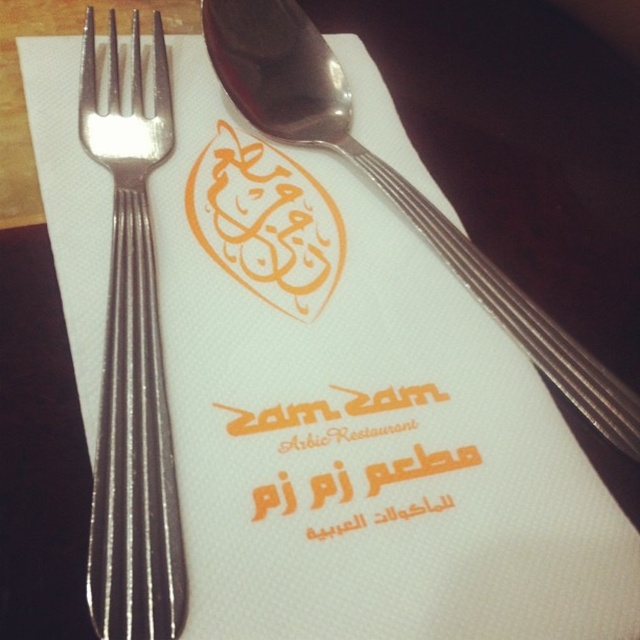
Between point (480, 468) and point (531, 305), which one is positioned in front?

Point (480, 468) is more forward.

Who is positioned more to the left, orange matte text at center or polished silver spoon at upper center?

orange matte text at center

Measure the distance between point (412, 486) and camera.

Point (412, 486) and camera are 20.01 inches apart from each other.

This screenshot has height=640, width=640. I want to click on orange matte text at center, so click(x=353, y=465).

Does satin silver fork at left appear on the left side of orange matte text at center?

Indeed, satin silver fork at left is positioned on the left side of orange matte text at center.

Does point (120, 556) come behind point (445, 524)?

No, it is not.

I want to click on satin silver fork at left, so (132, 369).

Consider the image. Does satin silver fork at left have a lesser width compared to polished silver spoon at upper center?

Yes.

Identify the location of satin silver fork at left. (132, 369).

Identify the location of satin silver fork at left. (132, 369).